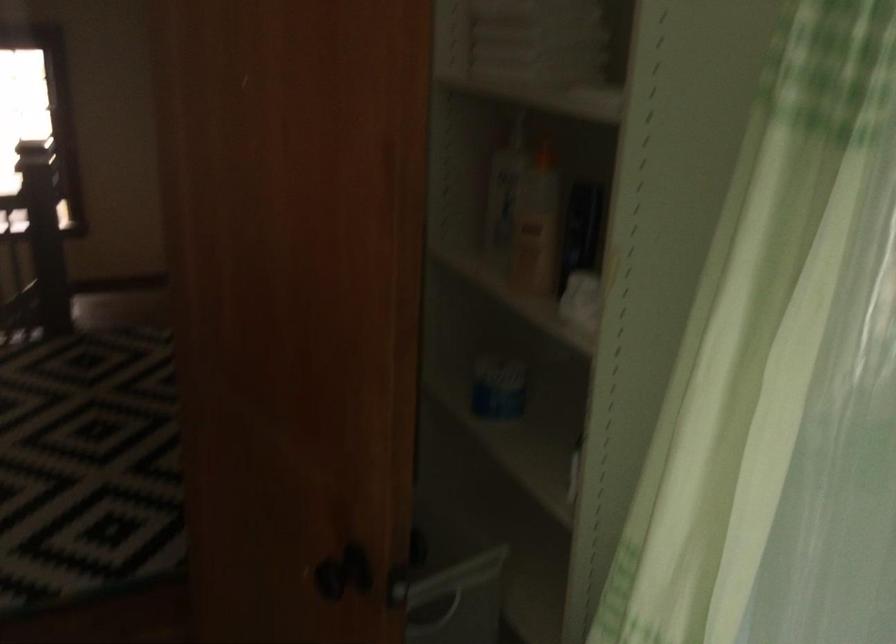
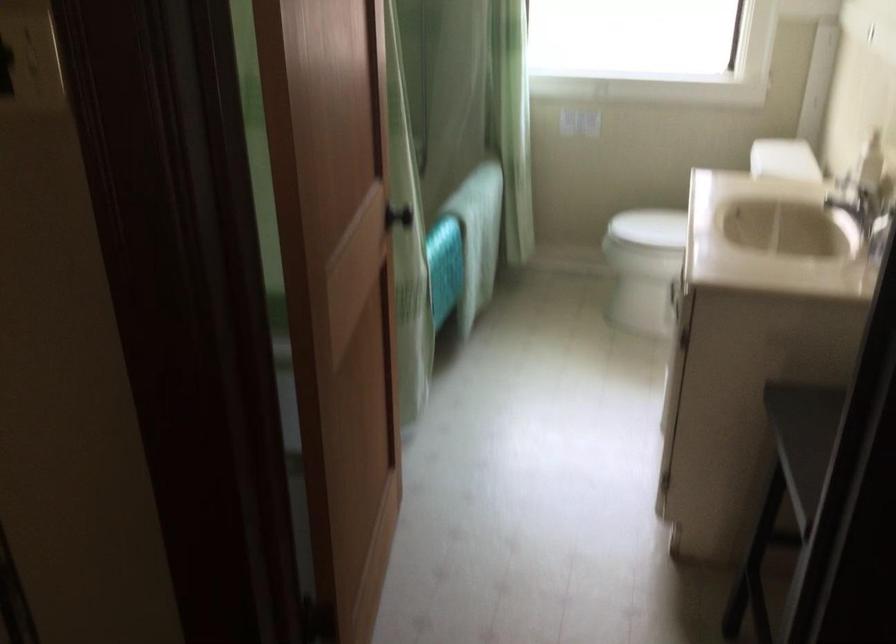
Question: I am providing you with two images of the same scene from different viewpoints. Please identify which objects are invisible in image2.

Choices:
 (A) white toilet lid
 (B) black door knob
 (C) red paper cup
 (D) black door handle

Answer: (B)